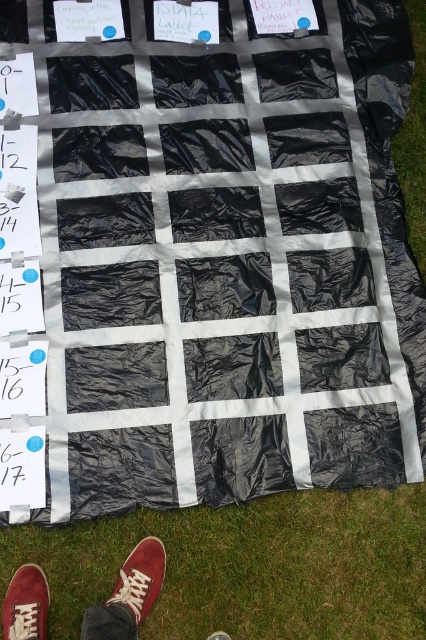
You are standing near the grid of black plastic bags and notice the green grass at lower center and the brown suede shoe at lower left. Which object takes up more space in the image?

The green grass at lower center is larger in size than the brown suede shoe at lower left, so it takes up more space in the image.

You are standing at the bottom left of the grid structure made of black plastic bags on the grass. You notice two points marked as point 1 at coordinates (29, 636) and point 2 at coordinates (230, 636). Which point is closer to you?

Point 1 at coordinates (29, 636) is closer to you than point 2 at coordinates (230, 636).

You are standing near the grid of black plastic bags and want to move from the point at coordinates point (399, 490) to the point at coordinates point (9, 605). Which direction should you move in to get closer to your destination?

To move from point (399, 490) to point (9, 605), you should move diagonally towards the lower right direction since point (9, 605) is closer to the viewer compared to point (399, 490).